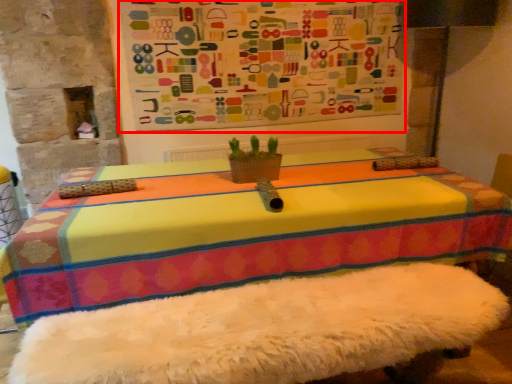
Question: Considering the relative positions of bulletin board (annotated by the red box) and flowerpot in the image provided, where is bulletin board (annotated by the red box) located with respect to the staircase?

Choices:
 (A) right
 (B) left

Answer: (A)